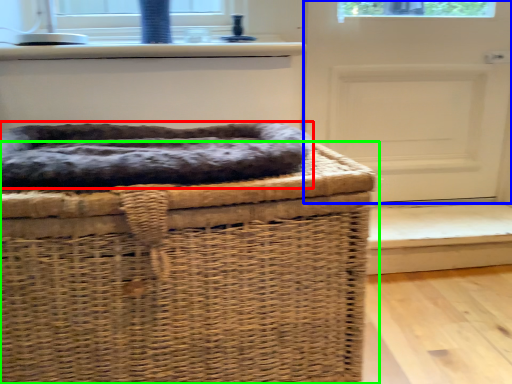
Question: Considering the real-world distances, which object is closest to dog bed (highlighted by a red box)? door (highlighted by a blue box) or furniture (highlighted by a green box).

Choices:
 (A) door
 (B) furniture

Answer: (B)